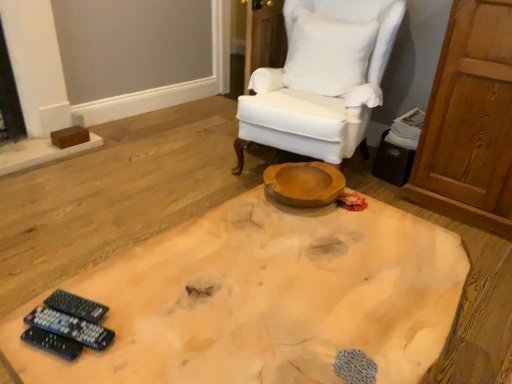
At what (x,y) coordinates should I click in order to perform the action: click on free space in front of black plastic remote controls at lower left, arranged as the 1th remote control when viewed from the front. Please return your answer as a coordinate pair (x, y). This screenshot has width=512, height=384. Looking at the image, I should click on (40, 368).